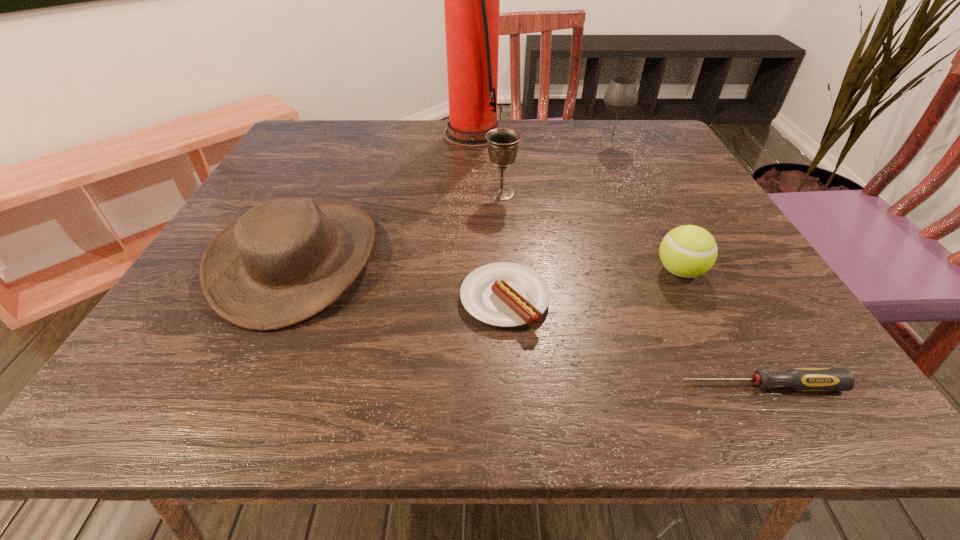
Where is `vacant region at the far left corner of the desktop`? The width and height of the screenshot is (960, 540). vacant region at the far left corner of the desktop is located at coordinates (334, 136).

The image size is (960, 540). In the image, there is a desktop. What are the coordinates of `vacant space at the far right corner` in the screenshot? It's located at (641, 154).

The image size is (960, 540). In order to click on vacant space at the near right corner of the desktop in this screenshot , I will do (x=852, y=406).

The height and width of the screenshot is (540, 960). Find the location of `empty space that is in between the second shortest object and the leftmost object`. empty space that is in between the second shortest object and the leftmost object is located at coordinates (401, 279).

Where is `vacant space that is in between the fifth shortest object and the tennis ball`? This screenshot has height=540, width=960. vacant space that is in between the fifth shortest object and the tennis ball is located at coordinates (590, 232).

The height and width of the screenshot is (540, 960). I want to click on free area in between the shortest object and the sixth tallest object, so click(632, 342).

This screenshot has height=540, width=960. In order to click on empty location between the fire extinguisher and the second tallest object in this screenshot , I will do `click(542, 139)`.

At what (x,y) coordinates should I click in order to perform the action: click on vacant area that lies between the sixth tallest object and the shortest object. Please return your answer as a coordinate pair (x, y). Looking at the image, I should click on (632, 342).

Identify the location of free space between the sausage and the fifth nearest object. This screenshot has height=540, width=960. (503, 246).

Identify the location of vacant space that's between the leftmost object and the fire extinguisher. The width and height of the screenshot is (960, 540). (386, 197).